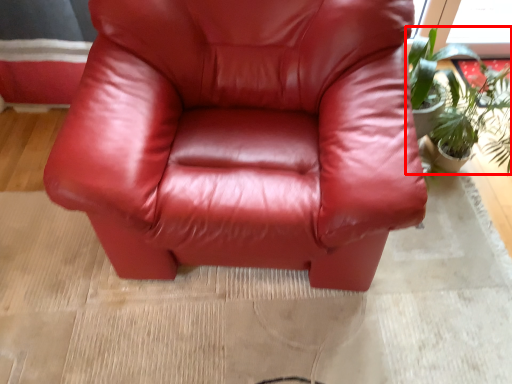
Question: From the image's perspective, what is the correct spatial relationship of houseplant (annotated by the red box) in relation to chair?

Choices:
 (A) above
 (B) below

Answer: (A)